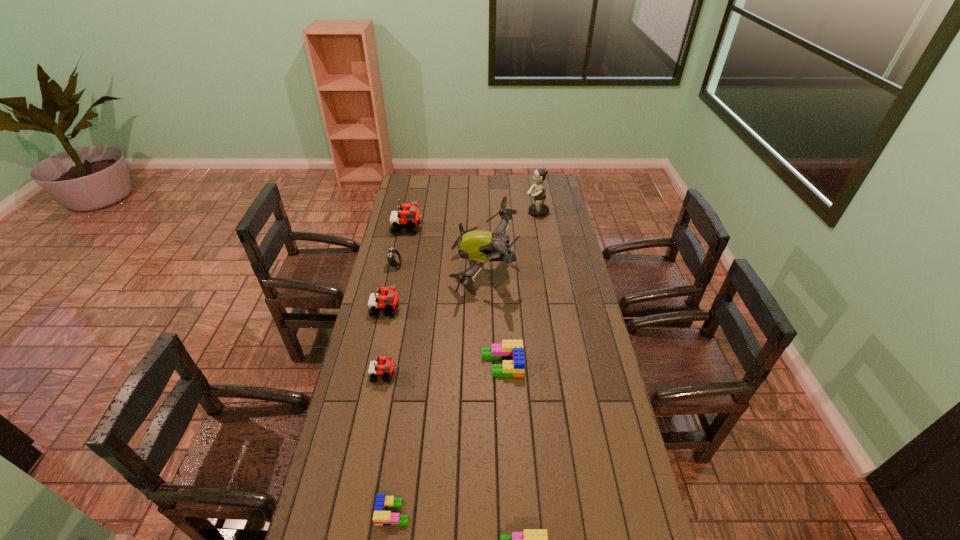
Locate an element on the screen. drone is located at coordinates (479, 247).

Identify the location of figurine. (539, 209).

At what (x,y) coordinates should I click in order to perform the action: click on the farthest object. Please return your answer as a coordinate pair (x, y). The image size is (960, 540). Looking at the image, I should click on (539, 209).

Image resolution: width=960 pixels, height=540 pixels. In order to click on the tallest Lego in this screenshot , I will do `click(409, 217)`.

The width and height of the screenshot is (960, 540). I want to click on the farthest red Lego, so click(409, 217).

The image size is (960, 540). I want to click on the second smallest red Lego, so click(x=391, y=300).

Identify the location of the fifth shortest Lego. The image size is (960, 540). (391, 300).

Locate an element on the screen. Image resolution: width=960 pixels, height=540 pixels. alarm clock is located at coordinates (394, 258).

The width and height of the screenshot is (960, 540). What are the coordinates of `the nearest red Lego` in the screenshot? It's located at (384, 366).

Where is `the smallest red Lego`? This screenshot has width=960, height=540. the smallest red Lego is located at coordinates tap(384, 366).